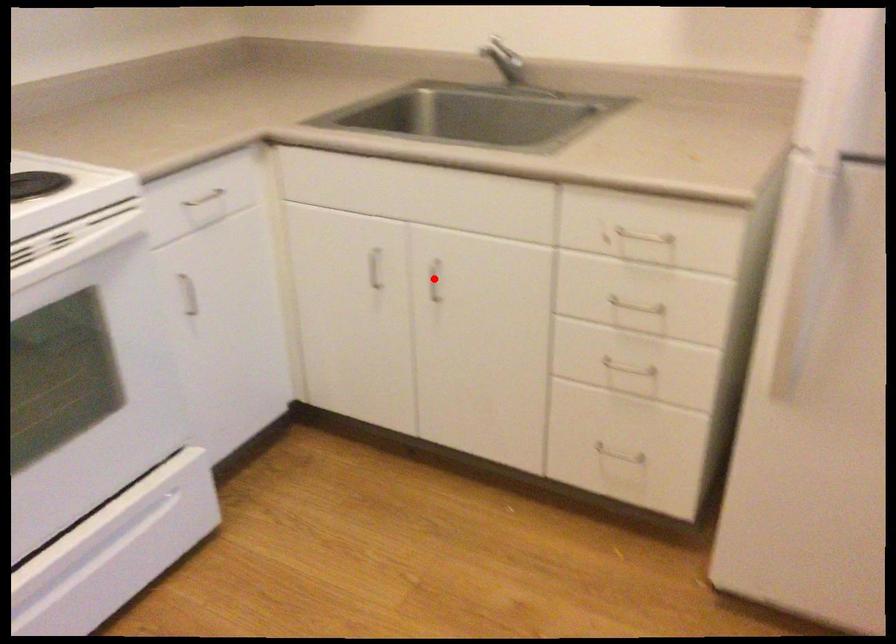
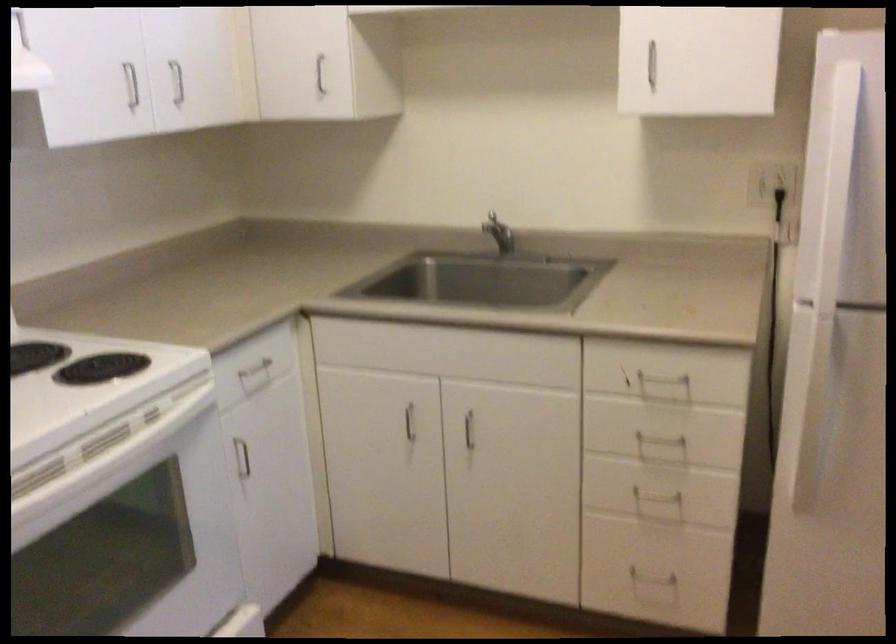
Locate, in the second image, the point that corresponds to the highlighted location in the first image.

(469, 430)